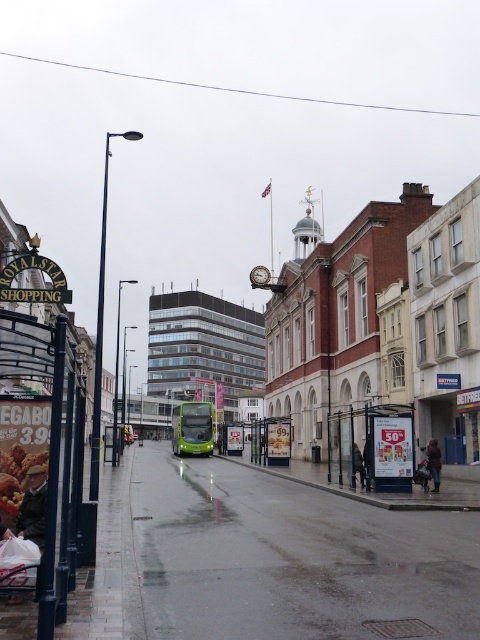
You are a delivery person trying to deliver a package to the address located at the base of the metallic signboard at left. You need to know if the green metallic bus at center will block your path. Based on the scene, can you determine if the bus is taller than the signboard?

The metallic signboard at left is not as tall as the green metallic bus at center, so the bus is taller than the signboard. Therefore, the bus could potentially block the path to the signboard if positioned in front of it.

In the scene shown: You are a pedestrian trying to cross the street. You see a green glass bus at center and a green metallic bus at center. Which bus is wider? Please choose the correct one.

The green metallic bus at center is wider than the green glass bus at center.